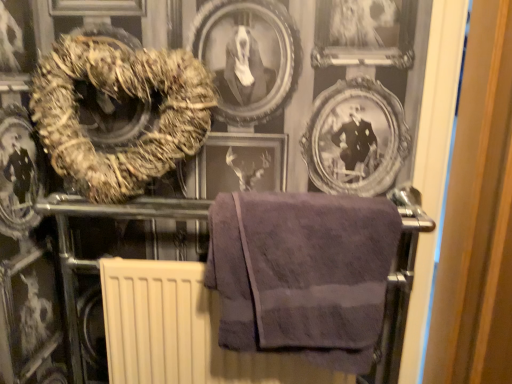
Question: From a real-world perspective, is purple cotton towel at center, which appears as the 1th towel when ordered from the bottom, positioned under purple cotton towel at upper left, the 1th towel when ordered from top to bottom, based on gravity?

Choices:
 (A) yes
 (B) no

Answer: (A)

Question: Is purple cotton towel at center, marked as the second towel in a left-to-right arrangement, at the left side of purple cotton towel at upper left, which is the second towel in bottom-to-top order?

Choices:
 (A) no
 (B) yes

Answer: (A)

Question: Is purple cotton towel at center, which appears as the 1th towel when ordered from the bottom, bigger than purple cotton towel at upper left, positioned as the first towel in left-to-right order?

Choices:
 (A) no
 (B) yes

Answer: (A)

Question: Is purple cotton towel at center, which is the 2th towel from top to bottom, completely or partially outside of purple cotton towel at upper left, the 2th towel positioned from the right?

Choices:
 (A) yes
 (B) no

Answer: (A)

Question: Can you confirm if purple cotton towel at center, marked as the second towel in a left-to-right arrangement, is shorter than purple cotton towel at upper left, which is the second towel in bottom-to-top order?

Choices:
 (A) yes
 (B) no

Answer: (A)

Question: From the image's perspective, is purple cotton towel at center, acting as the 1th towel starting from the right, on top of purple cotton towel at upper left, the 1th towel when ordered from top to bottom?

Choices:
 (A) yes
 (B) no

Answer: (B)

Question: Does purple cotton towel at upper left, the 1th towel when ordered from top to bottom, appear on the right side of purple cotton towel at center, acting as the 1th towel starting from the right?

Choices:
 (A) yes
 (B) no

Answer: (B)

Question: Is purple cotton towel at upper left, which is the second towel in bottom-to-top order, oriented towards purple cotton towel at center, marked as the second towel in a left-to-right arrangement?

Choices:
 (A) yes
 (B) no

Answer: (B)

Question: Is purple cotton towel at upper left, which is the second towel in bottom-to-top order, smaller than purple cotton towel at center, acting as the 1th towel starting from the right?

Choices:
 (A) yes
 (B) no

Answer: (B)

Question: Considering the relative sizes of purple cotton towel at upper left, the 2th towel positioned from the right, and purple cotton towel at center, marked as the second towel in a left-to-right arrangement, in the image provided, is purple cotton towel at upper left, the 2th towel positioned from the right, bigger than purple cotton towel at center, marked as the second towel in a left-to-right arrangement,?

Choices:
 (A) yes
 (B) no

Answer: (A)

Question: From a real-world perspective, is purple cotton towel at upper left, which is the second towel in bottom-to-top order, beneath purple cotton towel at center, which appears as the 1th towel when ordered from the bottom?

Choices:
 (A) yes
 (B) no

Answer: (B)

Question: Considering the relative sizes of purple cotton towel at upper left, which is the second towel in bottom-to-top order, and purple cotton towel at center, which is the 2th towel from top to bottom, in the image provided, is purple cotton towel at upper left, which is the second towel in bottom-to-top order, thinner than purple cotton towel at center, which is the 2th towel from top to bottom,?

Choices:
 (A) no
 (B) yes

Answer: (B)

Question: Considering the positions of purple cotton towel at center, acting as the 1th towel starting from the right, and purple cotton towel at upper left, which is the second towel in bottom-to-top order, in the image, is purple cotton towel at center, acting as the 1th towel starting from the right, taller or shorter than purple cotton towel at upper left, which is the second towel in bottom-to-top order,?

Choices:
 (A) short
 (B) tall

Answer: (A)